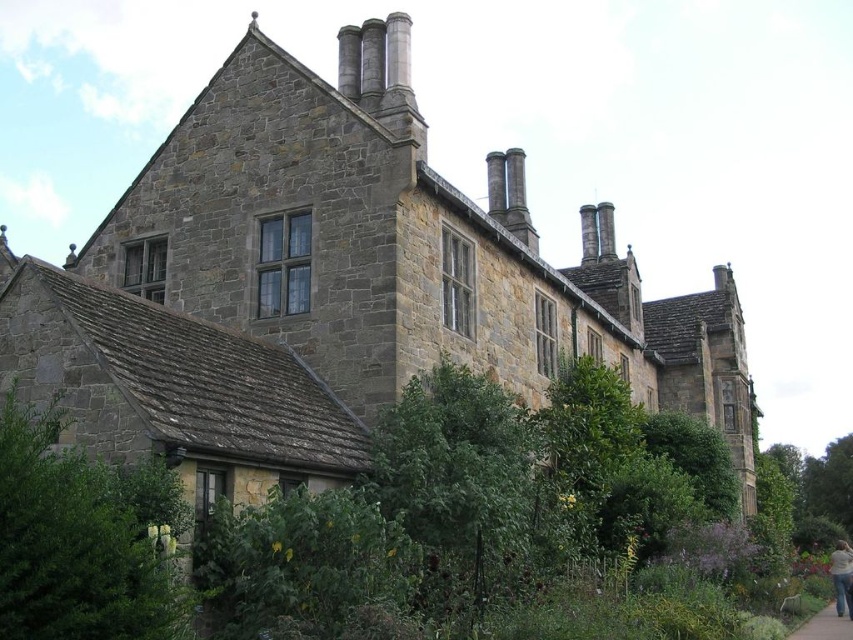
Question: Can you confirm if gray concrete pavement at lower right is smaller than light pink fabric at lower right?

Choices:
 (A) no
 (B) yes

Answer: (B)

Question: Does gray concrete pavement at lower right have a smaller size compared to light pink fabric at lower right?

Choices:
 (A) no
 (B) yes

Answer: (B)

Question: Which object appears farthest from the camera in this image?

Choices:
 (A) light pink fabric at lower right
 (B) gray concrete pavement at lower right

Answer: (A)

Question: Among these objects, which one is farthest from the camera?

Choices:
 (A) gray concrete pavement at lower right
 (B) light pink fabric at lower right

Answer: (B)

Question: Where is gray concrete pavement at lower right located in relation to light pink fabric at lower right in the image?

Choices:
 (A) right
 (B) left

Answer: (B)